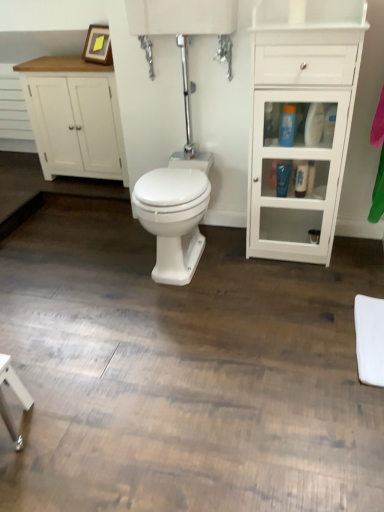
Image resolution: width=384 pixels, height=512 pixels. I want to click on blue glossy bottle at center right, which is counted as the third toiletry, starting from the bottom, so click(287, 125).

Image resolution: width=384 pixels, height=512 pixels. Describe the element at coordinates (283, 178) in the screenshot. I see `blue glossy lotion at center right, which appears as the second toiletry when viewed from the top` at that location.

Locate an element on the screen. The height and width of the screenshot is (512, 384). white glossy cabinet at right, positioned as the 1th bathroom cabinet in front-to-back order is located at coordinates (301, 120).

Where is `white glossy bottle at right, the first toiletry when ordered from bottom to top`? This screenshot has height=512, width=384. white glossy bottle at right, the first toiletry when ordered from bottom to top is located at coordinates (301, 179).

The height and width of the screenshot is (512, 384). I want to click on blue glossy bottle at center right, which is counted as the 1th toiletry, starting from the top, so click(x=287, y=125).

From the picture: Is white wood cabinet at left, which appears as the 2th bathroom cabinet when viewed from the right, far from wooden picture frame at upper left?

No, white wood cabinet at left, which appears as the 2th bathroom cabinet when viewed from the right, is not far away from wooden picture frame at upper left.

Is wooden picture frame at upper left a part of white wood cabinet at left, which is the first bathroom cabinet from back to front?

No, wooden picture frame at upper left is not surrounded by white wood cabinet at left, which is the first bathroom cabinet from back to front.

From a real-world perspective, who is located lower, white wood cabinet at left, the second bathroom cabinet viewed from the front, or wooden picture frame at upper left?

From a 3D spatial view, white wood cabinet at left, the second bathroom cabinet viewed from the front, is below.

Is white wood cabinet at left, the second bathroom cabinet viewed from the front, surrounding blue glossy lotion at center right, positioned as the second toiletry in bottom-to-top order?

No, blue glossy lotion at center right, positioned as the second toiletry in bottom-to-top order, is located outside of white wood cabinet at left, the second bathroom cabinet viewed from the front.

Which is in front, point (100, 158) or point (277, 186)?

The point (277, 186) is closer.

Find the location of `bathroom cabinet behind the blue glossy lotion at center right, which appears as the second toiletry when viewed from the top`. bathroom cabinet behind the blue glossy lotion at center right, which appears as the second toiletry when viewed from the top is located at coordinates (74, 117).

Is white wood cabinet at left, the second bathroom cabinet viewed from the front, turned away from blue glossy lotion at center right, which appears as the second toiletry when viewed from the top?

white wood cabinet at left, the second bathroom cabinet viewed from the front, is not turned away from blue glossy lotion at center right, which appears as the second toiletry when viewed from the top.

Based on the photo, which object is thinner, white glossy bidet at center or wooden picture frame at upper left?

wooden picture frame at upper left.

Locate an element on the screen. This screenshot has width=384, height=512. picture frame above the white glossy bidet at center (from a real-world perspective) is located at coordinates (98, 45).

Which object is positioned more to the left, white glossy bidet at center or wooden picture frame at upper left?

wooden picture frame at upper left is more to the left.

Is white glossy bidet at center closer to camera compared to wooden picture frame at upper left?

Yes, the depth of white glossy bidet at center is less than that of wooden picture frame at upper left.

Does white wood cabinet at left, positioned as the 1th bathroom cabinet in left-to-right order, appear on the left side of white glossy bottle at right, the first toiletry when ordered from bottom to top?

Correct, you'll find white wood cabinet at left, positioned as the 1th bathroom cabinet in left-to-right order, to the left of white glossy bottle at right, the first toiletry when ordered from bottom to top.

In terms of height, does white wood cabinet at left, which is the first bathroom cabinet from back to front, look taller or shorter compared to white glossy bottle at right, which ranks as the 3th toiletry in top-to-bottom order?

In the image, white wood cabinet at left, which is the first bathroom cabinet from back to front, appears to be taller than white glossy bottle at right, which ranks as the 3th toiletry in top-to-bottom order.

Is white glossy bottle at right, which ranks as the 3th toiletry in top-to-bottom order, completely or partially inside white wood cabinet at left, positioned as the 1th bathroom cabinet in left-to-right order?

No.

From a real-world perspective, between white glossy bottle at right, the first toiletry when ordered from bottom to top, and wooden picture frame at upper left, who is vertically lower?

In real-world perspective, white glossy bottle at right, the first toiletry when ordered from bottom to top, is lower.

Which of these two, white glossy bottle at right, the first toiletry when ordered from bottom to top, or wooden picture frame at upper left, stands taller?

wooden picture frame at upper left.

From the image's perspective, is white glossy bottle at right, which ranks as the 3th toiletry in top-to-bottom order, positioned above or below wooden picture frame at upper left?

Clearly, from the image's perspective, white glossy bottle at right, which ranks as the 3th toiletry in top-to-bottom order, is below wooden picture frame at upper left.

From the picture: Between white glossy bottle at right, the first toiletry when ordered from bottom to top, and wooden picture frame at upper left, which one has smaller width?

With smaller width is white glossy bottle at right, the first toiletry when ordered from bottom to top.

Is wooden picture frame at upper left not near white glossy bottle at right, the first toiletry when ordered from bottom to top?

Indeed, wooden picture frame at upper left is not near white glossy bottle at right, the first toiletry when ordered from bottom to top.

Is wooden picture frame at upper left spatially inside white glossy bottle at right, which ranks as the 3th toiletry in top-to-bottom order, or outside of it?

The correct answer is: outside.

Considering the relative sizes of wooden picture frame at upper left and white glossy bottle at right, which ranks as the 3th toiletry in top-to-bottom order, in the image provided, is wooden picture frame at upper left smaller than white glossy bottle at right, which ranks as the 3th toiletry in top-to-bottom order,?

Incorrect, wooden picture frame at upper left is not smaller in size than white glossy bottle at right, which ranks as the 3th toiletry in top-to-bottom order.

How different are the orientations of wooden picture frame at upper left and white glossy bottle at right, which ranks as the 3th toiletry in top-to-bottom order, in degrees?

The angular difference between wooden picture frame at upper left and white glossy bottle at right, which ranks as the 3th toiletry in top-to-bottom order, is 31.7 degrees.

Between blue glossy bottle at center right, which is counted as the 1th toiletry, starting from the top, and blue glossy lotion at center right, positioned as the second toiletry in bottom-to-top order, which one appears on the right side from the viewer's perspective?

From the viewer's perspective, blue glossy lotion at center right, positioned as the second toiletry in bottom-to-top order, appears more on the right side.

Who is taller, blue glossy bottle at center right, which is counted as the 1th toiletry, starting from the top, or blue glossy lotion at center right, positioned as the second toiletry in bottom-to-top order?

blue glossy lotion at center right, positioned as the second toiletry in bottom-to-top order, is taller.

From a real-world perspective, who is located higher, blue glossy bottle at center right, which is counted as the 1th toiletry, starting from the top, or blue glossy lotion at center right, positioned as the second toiletry in bottom-to-top order?

blue glossy bottle at center right, which is counted as the 1th toiletry, starting from the top.

Would you say blue glossy lotion at center right, which appears as the second toiletry when viewed from the top, is part of blue glossy bottle at center right, which is counted as the third toiletry, starting from the bottom,'s contents?

No, blue glossy bottle at center right, which is counted as the third toiletry, starting from the bottom, does not contain blue glossy lotion at center right, which appears as the second toiletry when viewed from the top.

Where is `picture frame above the white wood cabinet at left, the second bathroom cabinet viewed from the front (from the image's perspective)`? picture frame above the white wood cabinet at left, the second bathroom cabinet viewed from the front (from the image's perspective) is located at coordinates (98, 45).

This screenshot has height=512, width=384. I want to click on the 1st toiletry directly beneath the white wood cabinet at left, the second bathroom cabinet viewed from the front (from a real-world perspective), so click(x=283, y=178).

From the image, which object appears to be nearer to blue glossy bottle at center right, which is counted as the third toiletry, starting from the bottom, wooden picture frame at upper left or white glossy bidet at center?

The object closer to blue glossy bottle at center right, which is counted as the third toiletry, starting from the bottom, is white glossy bidet at center.

Looking at the image, which one is located closer to white glossy bottle at right, the first toiletry when ordered from bottom to top, wooden picture frame at upper left or blue glossy bottle at center right, which is counted as the 1th toiletry, starting from the top?

Based on the image, blue glossy bottle at center right, which is counted as the 1th toiletry, starting from the top, appears to be nearer to white glossy bottle at right, the first toiletry when ordered from bottom to top.

From the image, which object appears to be nearer to white glossy bottle at right, which ranks as the 3th toiletry in top-to-bottom order, white glossy bidet at center or white wood cabinet at left, which appears as the 2th bathroom cabinet when viewed from the right?

white glossy bidet at center is closer to white glossy bottle at right, which ranks as the 3th toiletry in top-to-bottom order.

Considering their positions, is white glossy bidet at center positioned further to blue glossy lotion at center right, which appears as the second toiletry when viewed from the top, than white glossy bottle at right, which ranks as the 3th toiletry in top-to-bottom order?

Based on the image, white glossy bidet at center appears to be further to blue glossy lotion at center right, which appears as the second toiletry when viewed from the top.

Based on the photo, estimate the real-world distances between objects in this image. Which object is further from white glossy cabinet at right, which is counted as the first bathroom cabinet, starting from the right, white wood cabinet at left, which appears as the 2th bathroom cabinet when viewed from the right, or white glossy bidet at center?

Among the two, white wood cabinet at left, which appears as the 2th bathroom cabinet when viewed from the right, is located further to white glossy cabinet at right, which is counted as the first bathroom cabinet, starting from the right.

Considering their positions, is white glossy bottle at right, the first toiletry when ordered from bottom to top, positioned further to white glossy cabinet at right, which is counted as the 2th bathroom cabinet, starting from the back, than wooden picture frame at upper left?

Among the two, wooden picture frame at upper left is located further to white glossy cabinet at right, which is counted as the 2th bathroom cabinet, starting from the back.

Estimate the real-world distances between objects in this image. Which object is further from wooden picture frame at upper left, white glossy cabinet at right, the 2th bathroom cabinet in the left-to-right sequence, or blue glossy lotion at center right, which appears as the second toiletry when viewed from the top?

blue glossy lotion at center right, which appears as the second toiletry when viewed from the top.

Which object lies further to the anchor point white glossy bidet at center, white glossy cabinet at right, positioned as the 1th bathroom cabinet in front-to-back order, or blue glossy bottle at center right, which is counted as the 1th toiletry, starting from the top?

The object further to white glossy bidet at center is blue glossy bottle at center right, which is counted as the 1th toiletry, starting from the top.

Where is `picture frame located between white wood cabinet at left, the second bathroom cabinet viewed from the front, and white glossy cabinet at right, which is counted as the 2th bathroom cabinet, starting from the back, in the left-right direction`? The height and width of the screenshot is (512, 384). picture frame located between white wood cabinet at left, the second bathroom cabinet viewed from the front, and white glossy cabinet at right, which is counted as the 2th bathroom cabinet, starting from the back, in the left-right direction is located at coordinates (98, 45).

The width and height of the screenshot is (384, 512). I want to click on toiletry located between white glossy bidet at center and blue glossy lotion at center right, which appears as the second toiletry when viewed from the top, in the left-right direction, so click(287, 125).

Locate an element on the screen. The image size is (384, 512). bidet situated between white wood cabinet at left, the second bathroom cabinet viewed from the front, and blue glossy lotion at center right, which appears as the second toiletry when viewed from the top, from left to right is located at coordinates tap(173, 219).

Find the location of a particular element. bidet between white wood cabinet at left, which appears as the 2th bathroom cabinet when viewed from the right, and blue glossy bottle at center right, which is counted as the third toiletry, starting from the bottom, in the horizontal direction is located at coordinates (173, 219).